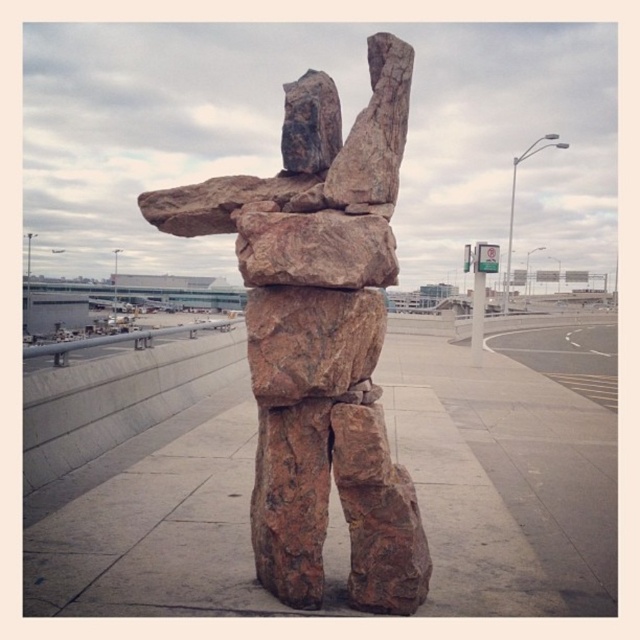
You are standing on the brown stone pavement at center and want to touch the brown rock sculpture at center. Can you reach it without moving your feet?

The brown stone pavement at center is positioned under the brown rock sculpture at center, so yes, you can reach it without moving your feet since it is directly above you.

You are an airport maintenance worker who needs to place a new bench exactly in the middle between the brown stone pavement at center and the brown rock sculpture at center. Which object will the bench be closer to?

The bench will be closer to the brown stone pavement at center because it is smaller than the brown rock sculpture at center.

You are standing in front of the brown rock sculpture at center and want to step onto the brown stone pavement at center. Which direction should you move to reach the pavement?

To reach the brown stone pavement at center from the brown rock sculpture at center, you should move forward since the pavement is closer to you than the sculpture.